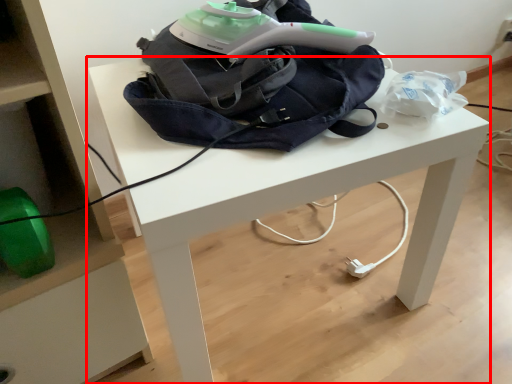
Question: From the image's perspective, where is table (annotated by the red box) located relative to bag?

Choices:
 (A) below
 (B) above

Answer: (A)